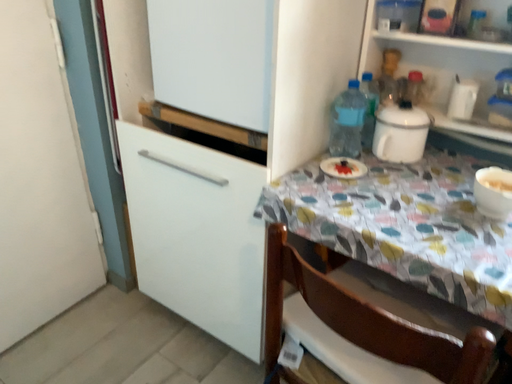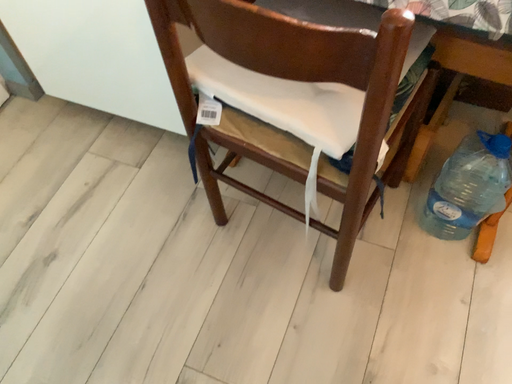
Question: Which way did the camera rotate in the video?

Choices:
 (A) rotated left
 (B) rotated right

Answer: (B)